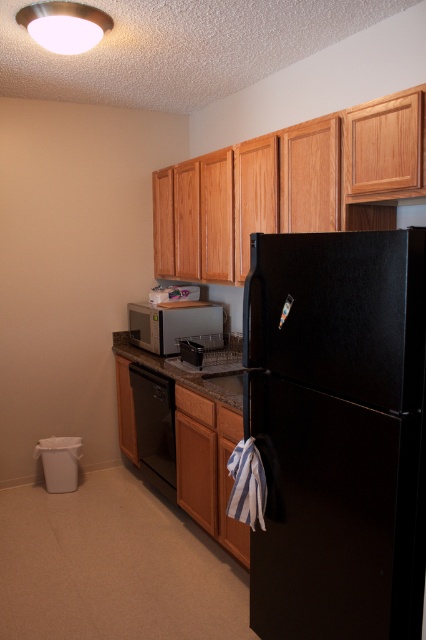
Looking at this image, you are a delivery person who needs to place a new oven between the black matte refrigerator at center and the satin silver microwave at center. The oven is 1.5 meters wide. Can the oven fit in the space between them?

The distance between the black matte refrigerator at center and the satin silver microwave at center is 1.82 meters. Since the oven is 1.5 meters wide, it can fit in the available space as 1.5 meters is less than 1.82 meters.

You are standing in the kitchen and want to place a new appliance. Where exactly is the black matte refrigerator at center located in the room?

The black matte refrigerator at center is located at point (337,433) in the room.